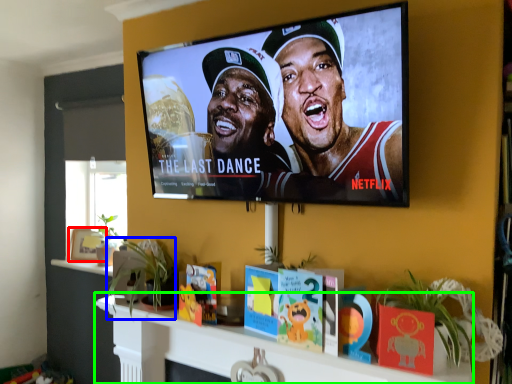
Question: Estimate the real-world distances between objects in this image. Which object is closer to picture frame (highlighted by a red box), plant (highlighted by a blue box) or shelf (highlighted by a green box)?

Choices:
 (A) plant
 (B) shelf

Answer: (A)